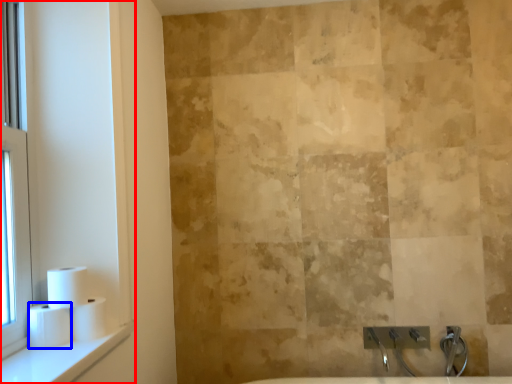
Question: Which point is further to the camera, window frame (highlighted by a red box) or toilet paper (highlighted by a blue box)?

Choices:
 (A) window frame
 (B) toilet paper

Answer: (B)